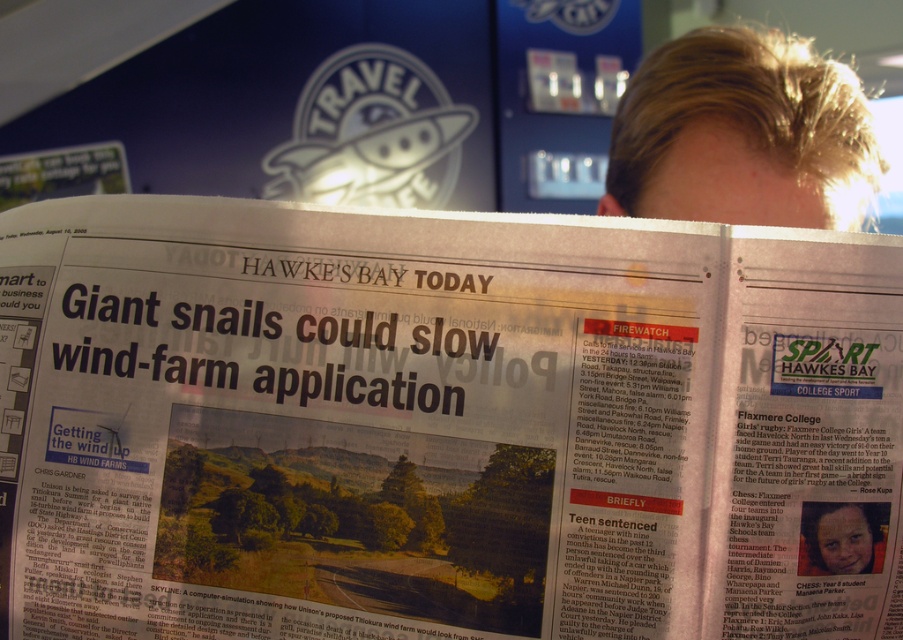
Question: Which of the following is the farthest from the observer?

Choices:
 (A) (872, 134)
 (B) (872, 444)

Answer: (A)

Question: Can you confirm if white glossy newspaper at center is positioned to the left of blonde hair at upper right?

Choices:
 (A) yes
 (B) no

Answer: (A)

Question: In this image, where is white glossy newspaper at center located relative to blonde hair at upper right?

Choices:
 (A) below
 (B) above

Answer: (A)

Question: Can you confirm if white glossy newspaper at center is positioned to the left of blonde hair at upper right?

Choices:
 (A) yes
 (B) no

Answer: (A)

Question: Which point is closer to the camera?

Choices:
 (A) blonde hair at upper right
 (B) white glossy newspaper at center

Answer: (B)